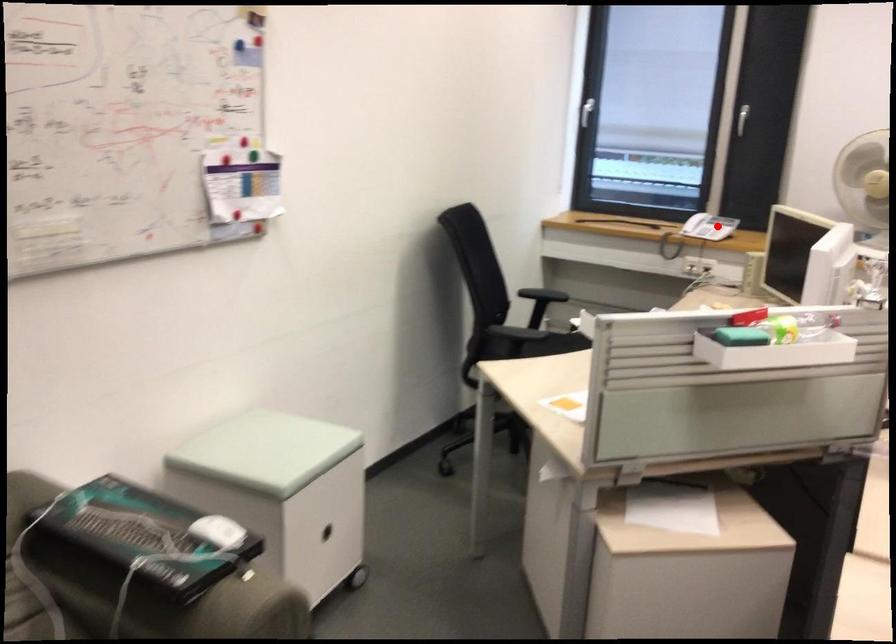
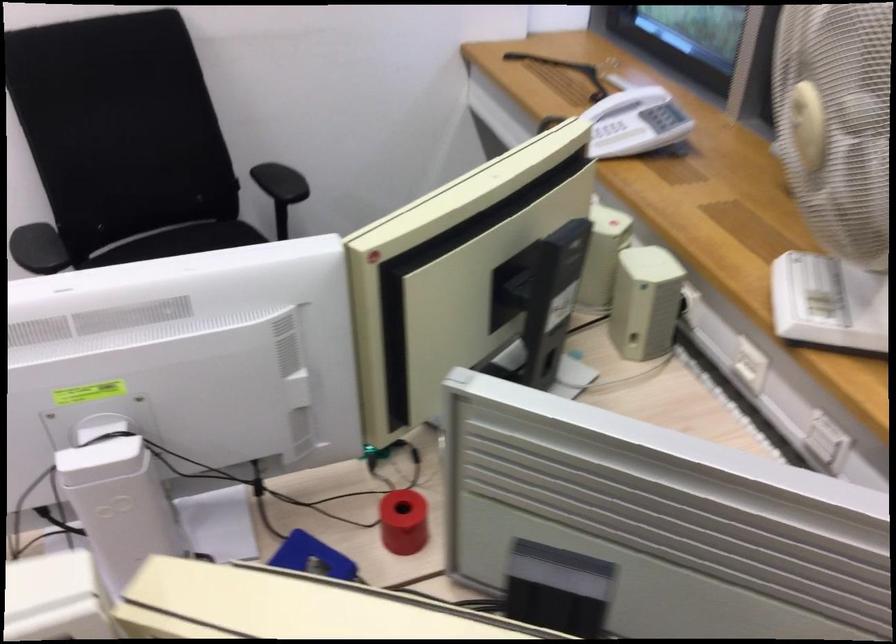
Find the pixel in the second image that matches the highlighted location in the first image.

(617, 138)